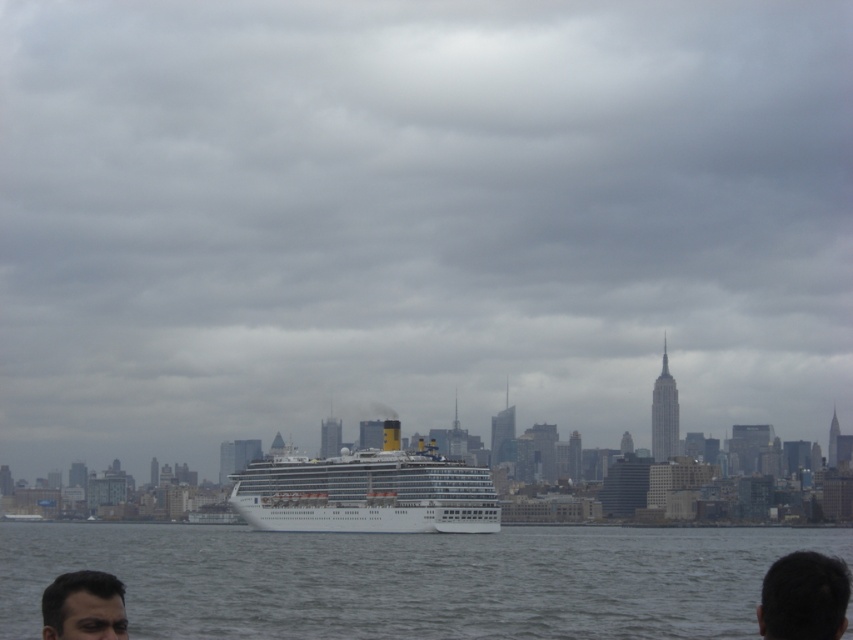
You are standing on the cruise ship and want to take a photo of the city skyline. The camera you have can focus on objects up to 300 meters away. Is the point at coordinates point (245, 476) within the camera focus range?

The point at point (245, 476) is 285.45 meters away from the viewer. Since the camera can focus up to 300 meters, the point is within the camera focus range.

You are a photographer standing on the shore of the river, aiming to capture the white glossy cruise ship at center in your shot. If your camera has a maximum zoom range of 100 meters, will you be able to get a clear closeup of the ship?

The distance between the white glossy cruise ship at center and the camera is 223.49 meters. Since the camera can only zoom up to 100 meters, the photographer will not be able to capture a clear closeup of the ship.

You are a photographer on the cruise ship and want to capture both the dark hair at lower right and the dark brown hair at lower left in a single frame. Which person has a better chance of being fully visible in the photo?

The dark hair at lower right has a better chance of being fully visible in the photo because it is larger in size than the dark brown hair at lower left, making it easier to fit within the frame.